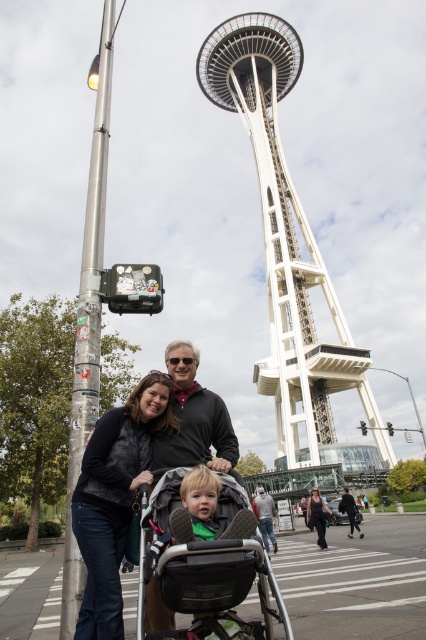
Is the position of denim jacket at lower left more distant than that of light gray jeans at center?

No.

Which of these two, denim jacket at lower left or light gray jeans at center, stands shorter?

Standing shorter between the two is light gray jeans at center.

Image resolution: width=426 pixels, height=640 pixels. Find the location of `denim jacket at lower left`. denim jacket at lower left is located at coordinates (115, 499).

Locate an element on the screen. The image size is (426, 640). light gray jeans at center is located at coordinates (265, 516).

Can you confirm if light gray jeans at center is wider than black matte pants at lower right?

Correct, the width of light gray jeans at center exceeds that of black matte pants at lower right.

Is point (261, 504) positioned before point (311, 529)?

Yes, it is in front of point (311, 529).

Identify the location of light gray jeans at center. The width and height of the screenshot is (426, 640). (265, 516).

Is black textured stroller at center taller than denim jacket at lower left?

Incorrect, black textured stroller at center's height is not larger of denim jacket at lower left's.

Is black textured stroller at center to the left of denim jacket at lower left from the viewer's perspective?

No, black textured stroller at center is not to the left of denim jacket at lower left.

Which is in front, point (256, 568) or point (109, 605)?

Positioned in front is point (256, 568).

I want to click on black textured stroller at center, so click(204, 561).